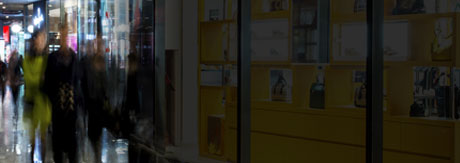
Locate an element on the screen. The image size is (460, 163). ceiling is located at coordinates (11, 6).